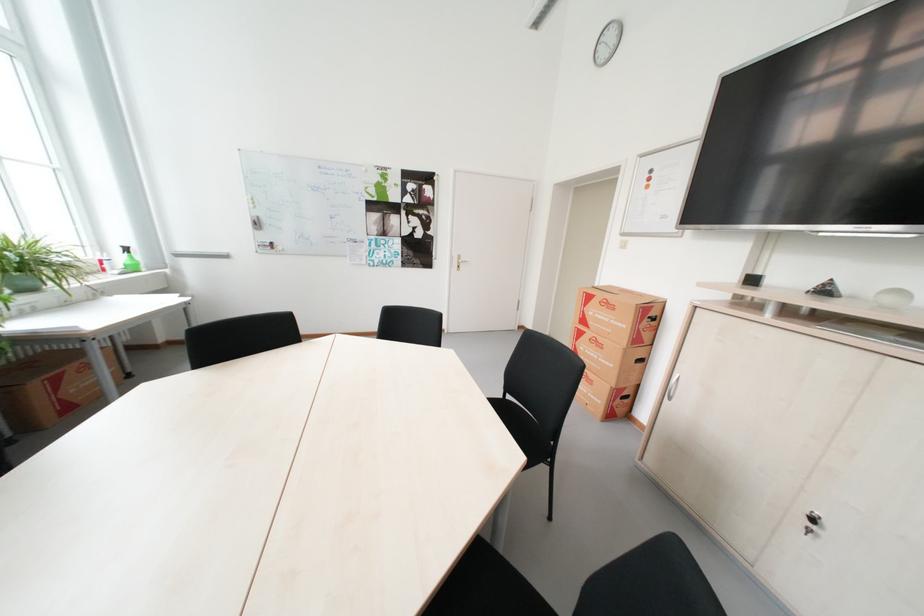
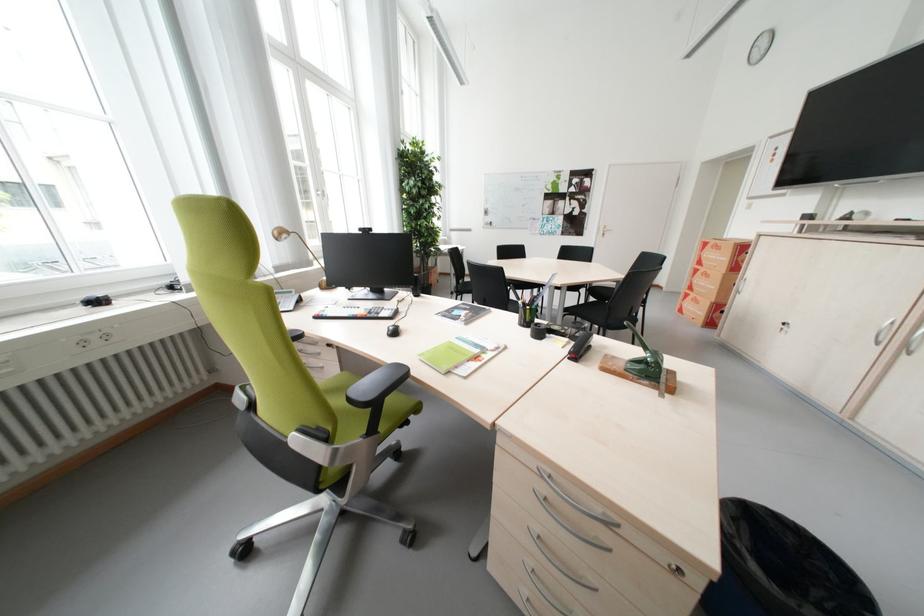
Question: In a continuous first-person perspective shot, in which direction is the camera moving?

Choices:
 (A) Left
 (B) Right
 (C) Forward
 (D) Backward

Answer: (D)